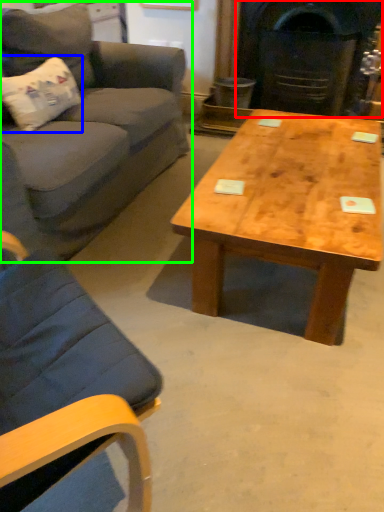
Question: Which object is the farthest from fireplace (highlighted by a red box)? Choose among these: pillow (highlighted by a blue box) or studio couch (highlighted by a green box).

Choices:
 (A) pillow
 (B) studio couch

Answer: (A)